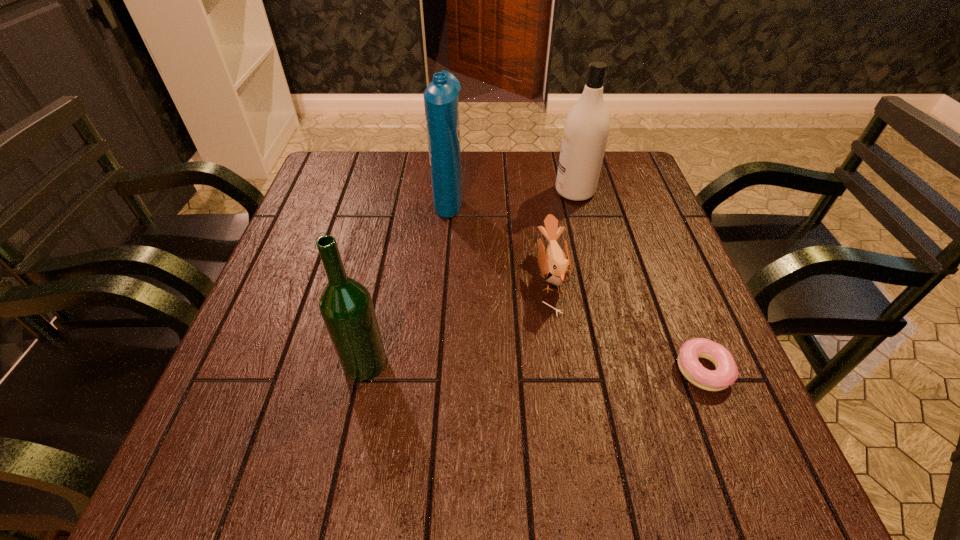
At what (x,y) coordinates should I click in order to perform the action: click on vacant space that satisfies the following two spatial constraints: 1. on the front-facing side of the right shampoo; 2. on the front side of the left shampoo. Please return your answer as a coordinate pair (x, y). Image resolution: width=960 pixels, height=540 pixels. Looking at the image, I should click on (576, 197).

This screenshot has width=960, height=540. What are the coordinates of `vacant point that satisfies the following two spatial constraints: 1. at the beak of the fourth tallest object; 2. on the left side of the doughnut` in the screenshot? It's located at (565, 370).

In order to click on vacant region that satisfies the following two spatial constraints: 1. on the front-facing side of the fourth object from left to right; 2. on the right side of the doughnut in this screenshot , I will do `click(621, 370)`.